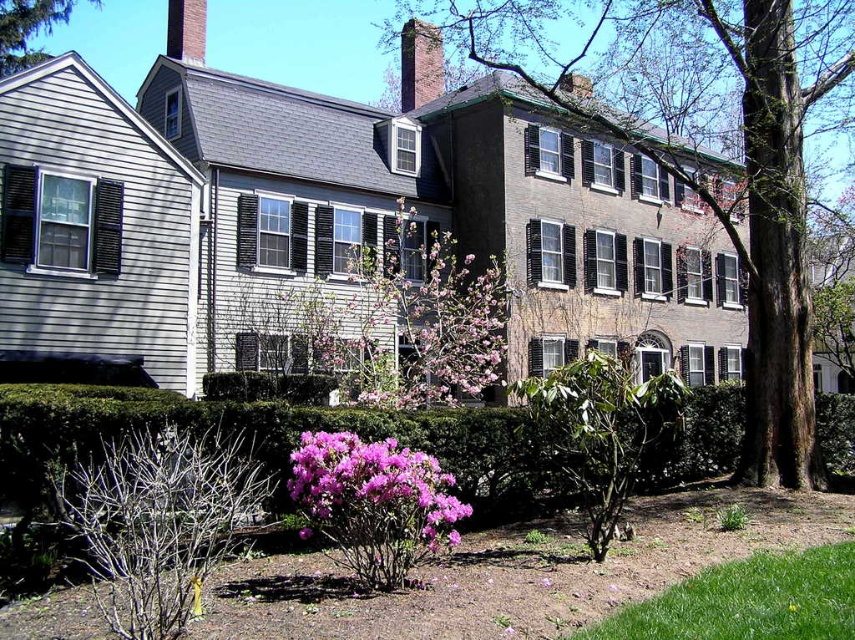
Question: Can you confirm if green leafy hedge at lower center is positioned below bare branches at lower left?

Choices:
 (A) yes
 (B) no

Answer: (B)

Question: Which of the following is the closest to the observer?

Choices:
 (A) brown wood tree at upper left
 (B) brown textured tree at center

Answer: (B)

Question: Considering the real-world distances, which object is farthest from the pink bloom at center?

Choices:
 (A) bare branches at lower left
 (B) brown textured tree at center
 (C) purple matte flower at center

Answer: (B)

Question: Does pink bloom at center come behind purple matte flower at center?

Choices:
 (A) no
 (B) yes

Answer: (B)

Question: Which of the following is the farthest from the observer?

Choices:
 (A) (317, 522)
 (B) (635, 8)

Answer: (B)

Question: Can you confirm if bare branches at lower left is positioned below pink bloom at center?

Choices:
 (A) no
 (B) yes

Answer: (B)